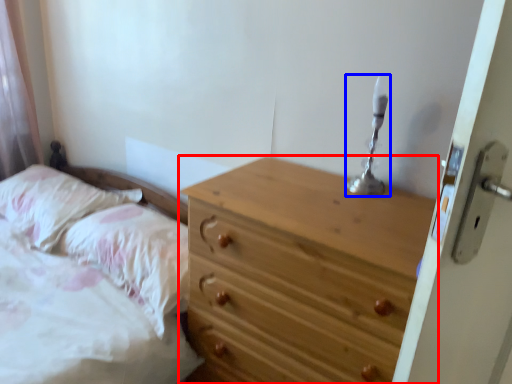
Question: Which point is further to the camera, chest of drawers (highlighted by a red box) or candle holder (highlighted by a blue box)?

Choices:
 (A) chest of drawers
 (B) candle holder

Answer: (B)